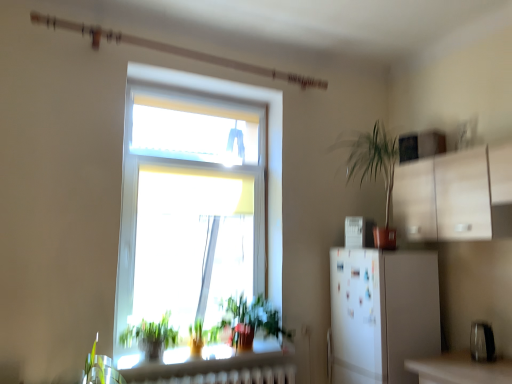
Question: Is white glossy refrigerator at right, the second appliance positioned from the front, oriented away from green leafy plant at lower left, which is counted as the 2th vegetation, starting from the right?

Choices:
 (A) no
 (B) yes

Answer: (A)

Question: Does white glossy refrigerator at right, the 1th appliance when ordered from left to right, contain green leafy plant at lower left, the first vegetation in the left-to-right sequence?

Choices:
 (A) yes
 (B) no

Answer: (B)

Question: Can you confirm if white glossy refrigerator at right, the 2th appliance when ordered from right to left, is taller than green leafy plant at lower left, the first vegetation in the left-to-right sequence?

Choices:
 (A) yes
 (B) no

Answer: (B)

Question: Would you consider white glossy refrigerator at right, which is the first appliance in back-to-front order, to be distant from green leafy plant at lower left, the first vegetation in the left-to-right sequence?

Choices:
 (A) yes
 (B) no

Answer: (A)

Question: Can you confirm if white glossy refrigerator at right, acting as the first appliance starting from the top, is smaller than green leafy plant at lower left, the first vegetation in the left-to-right sequence?

Choices:
 (A) yes
 (B) no

Answer: (A)

Question: Looking at their shapes, would you say white glossy refrigerator at right, which is the first appliance in back-to-front order, is wider or thinner than metallic silver toaster at lower right, the 2th appliance when ordered from back to front?

Choices:
 (A) thin
 (B) wide

Answer: (B)

Question: From the image's perspective, is white glossy refrigerator at right, acting as the first appliance starting from the top, above or below metallic silver toaster at lower right, placed as the first appliance when sorted from front to back?

Choices:
 (A) below
 (B) above

Answer: (B)

Question: Is white glossy refrigerator at right, which is the first appliance in back-to-front order, in front of or behind metallic silver toaster at lower right, which is counted as the 2th appliance, starting from the left, in the image?

Choices:
 (A) front
 (B) behind

Answer: (B)

Question: Is white glossy refrigerator at right, which appears as the second appliance when ordered from the bottom, bigger or smaller than metallic silver toaster at lower right, the 1th appliance from the bottom?

Choices:
 (A) small
 (B) big

Answer: (B)

Question: Is point (233, 344) closer or farther from the camera than point (485, 322)?

Choices:
 (A) farther
 (B) closer

Answer: (A)

Question: Based on their sizes in the image, would you say green leafy plant at lower center, the 2th vegetation from the left, is bigger or smaller than metallic silver toaster at lower right, the 2th appliance when ordered from back to front?

Choices:
 (A) big
 (B) small

Answer: (A)

Question: Looking at their shapes, would you say green leafy plant at lower center, the 2th vegetation from the left, is wider or thinner than metallic silver toaster at lower right, the 2th appliance when ordered from back to front?

Choices:
 (A) thin
 (B) wide

Answer: (B)

Question: Would you say green leafy plant at lower center, acting as the first vegetation starting from the right, is to the left or to the right of metallic silver toaster at lower right, the 1th appliance from the bottom, in the picture?

Choices:
 (A) left
 (B) right

Answer: (A)

Question: Considering the relative positions of metallic silver toaster at lower right, the 1th appliance from the bottom, and green leafy plant at lower center, acting as the first vegetation starting from the right, in the image provided, is metallic silver toaster at lower right, the 1th appliance from the bottom, to the left or to the right of green leafy plant at lower center, acting as the first vegetation starting from the right,?

Choices:
 (A) left
 (B) right

Answer: (B)

Question: From the image's perspective, is metallic silver toaster at lower right, positioned as the 2th appliance in top-to-bottom order, positioned above or below green leafy plant at lower center, the 2th vegetation from the left?

Choices:
 (A) below
 (B) above

Answer: (A)